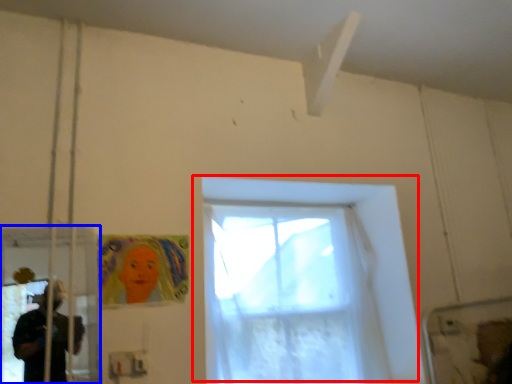
Question: Which point is closer to the camera, window (highlighted by a red box) or screen door (highlighted by a blue box)?

Choices:
 (A) window
 (B) screen door

Answer: (B)